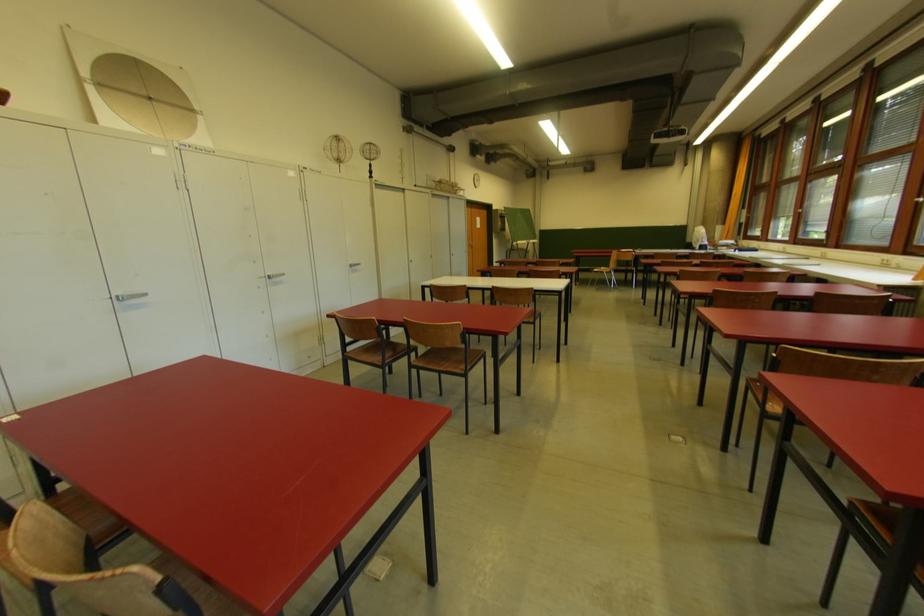
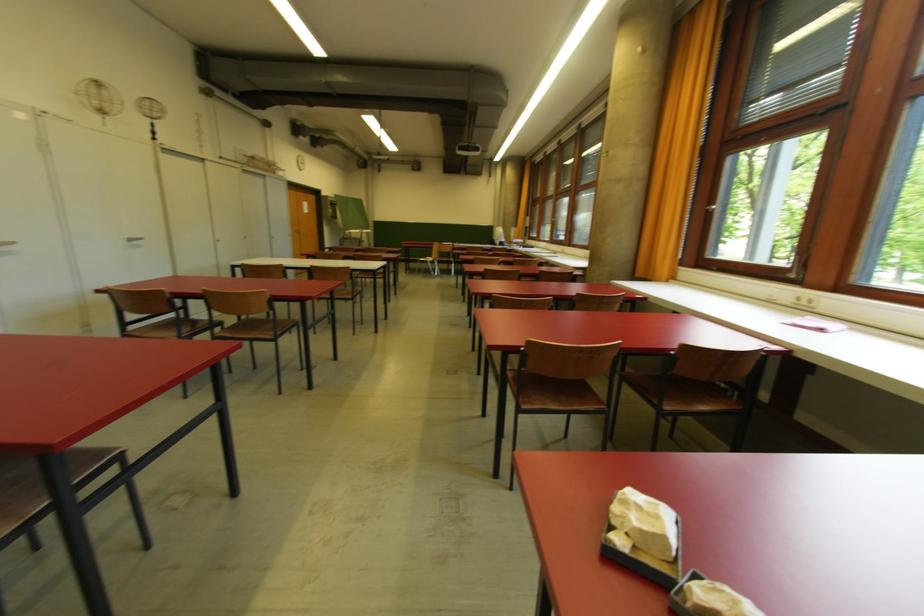
Where in the second image is the point corresponding to point (466, 369) from the first image?

(274, 334)